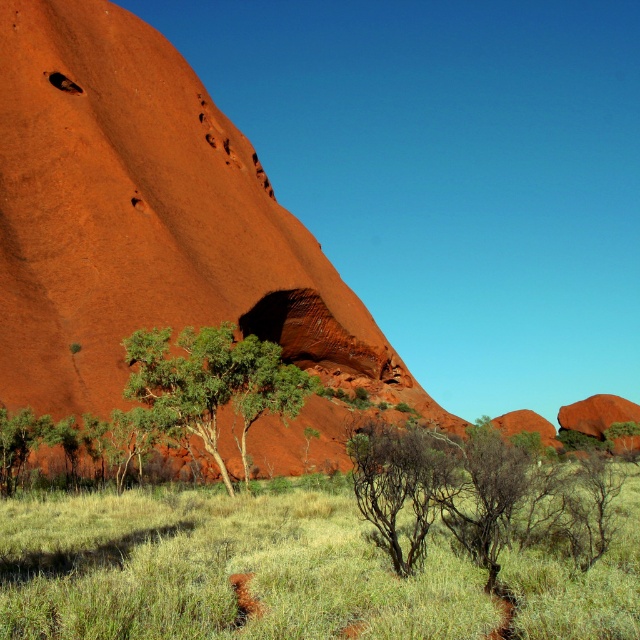
Question: Does matte orange rock at center appear over green leafy tree at center?

Choices:
 (A) no
 (B) yes

Answer: (B)

Question: Where is green grass at lower center located in relation to green leafy tree at center in the image?

Choices:
 (A) below
 (B) above

Answer: (A)

Question: Considering the real-world distances, which object is farthest from the green leafy shrub at center?

Choices:
 (A) brown/dry shrub at center
 (B) matte orange rock at center
 (C) green grass at lower center
 (D) green leafy tree at center

Answer: (B)

Question: Which object is positioned farthest from the green leafy shrub at center?

Choices:
 (A) matte orange rock at center
 (B) green leafy tree at center
 (C) brown/dry shrub at center

Answer: (A)

Question: Which object is closer to the camera taking this photo?

Choices:
 (A) green grass at lower center
 (B) green leafy shrub at center
 (C) green leafy tree at center

Answer: (A)

Question: Is green grass at lower center to the right of green leafy shrub at center from the viewer's perspective?

Choices:
 (A) no
 (B) yes

Answer: (A)